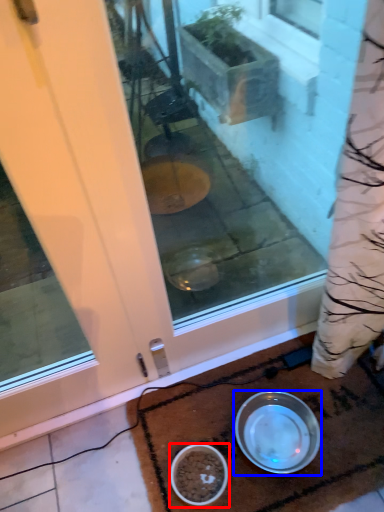
Question: Which object appears farthest to the camera in this image, bowl (highlighted by a red box) or bowl (highlighted by a blue box)?

Choices:
 (A) bowl
 (B) bowl

Answer: (B)